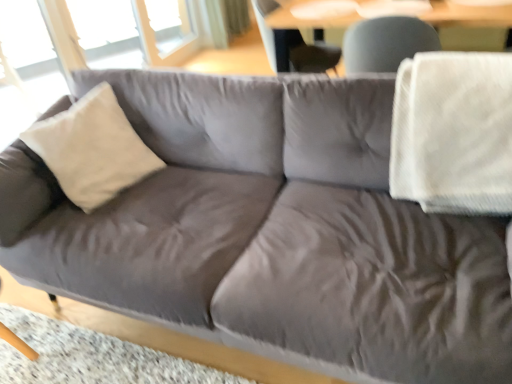
Question: Is transparent glass window at upper left looking in the opposite direction of white textured blanket at right?

Choices:
 (A) no
 (B) yes

Answer: (A)

Question: Considering the relative positions of transparent glass window at upper left and white textured blanket at right in the image provided, is transparent glass window at upper left in front of white textured blanket at right?

Choices:
 (A) no
 (B) yes

Answer: (A)

Question: Is transparent glass window at upper left in contact with white textured blanket at right?

Choices:
 (A) yes
 (B) no

Answer: (B)

Question: Is transparent glass window at upper left taller than white textured blanket at right?

Choices:
 (A) no
 (B) yes

Answer: (B)

Question: Considering the relative sizes of transparent glass window at upper left and white textured blanket at right in the image provided, is transparent glass window at upper left shorter than white textured blanket at right?

Choices:
 (A) yes
 (B) no

Answer: (B)

Question: Is transparent glass window at upper left to the left of white textured blanket at right from the viewer's perspective?

Choices:
 (A) yes
 (B) no

Answer: (A)

Question: Are transparent glass window at upper left and matte gray swivel chair at upper center far apart?

Choices:
 (A) yes
 (B) no

Answer: (A)

Question: From the image's perspective, is transparent glass window at upper left on matte gray swivel chair at upper center?

Choices:
 (A) yes
 (B) no

Answer: (A)

Question: Does transparent glass window at upper left have a lesser width compared to matte gray swivel chair at upper center?

Choices:
 (A) yes
 (B) no

Answer: (A)

Question: From a real-world perspective, is transparent glass window at upper left positioned under matte gray swivel chair at upper center based on gravity?

Choices:
 (A) yes
 (B) no

Answer: (A)

Question: Can you confirm if transparent glass window at upper left is taller than matte gray swivel chair at upper center?

Choices:
 (A) yes
 (B) no

Answer: (A)

Question: From a real-world perspective, is transparent glass window at upper left on top of matte gray swivel chair at upper center?

Choices:
 (A) no
 (B) yes

Answer: (A)

Question: Can you confirm if matte gray swivel chair at upper center is thinner than transparent glass window at upper left?

Choices:
 (A) no
 (B) yes

Answer: (A)